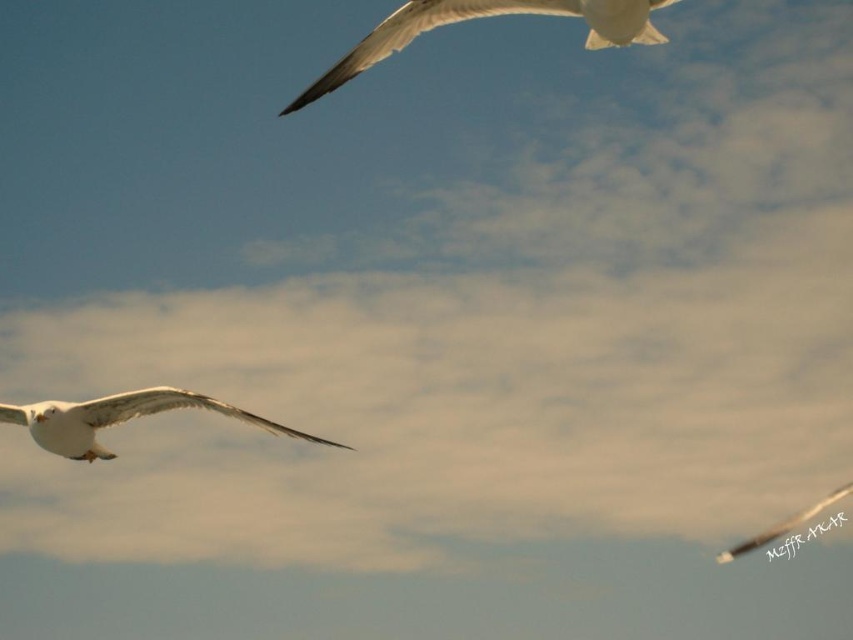
Question: Which point is closer to the camera?

Choices:
 (A) (355, 61)
 (B) (775, 525)

Answer: (A)

Question: Which point is closer to the camera taking this photo?

Choices:
 (A) (45, 440)
 (B) (438, 10)

Answer: (B)

Question: Which of the following is the closest to the observer?

Choices:
 (A) white feathered bird at center
 (B) white feathered bird at upper left

Answer: (B)

Question: Is white feathered bird at upper center to the right of white feathered bird at upper left from the viewer's perspective?

Choices:
 (A) no
 (B) yes

Answer: (A)

Question: Does white feathered bird at upper center have a smaller size compared to white feathered bird at center?

Choices:
 (A) yes
 (B) no

Answer: (A)

Question: Does white feathered bird at center appear on the left side of white feathered bird at upper left?

Choices:
 (A) yes
 (B) no

Answer: (A)